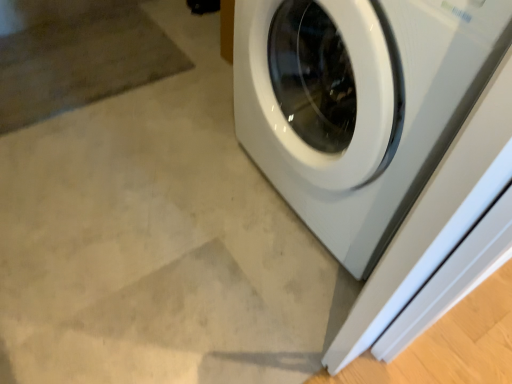
What do you see at coordinates (359, 104) in the screenshot? I see `white glossy washing machine at lower right` at bounding box center [359, 104].

Measure the distance between white glossy washing machine at lower right and camera.

They are 20.46 inches apart.

Locate an element on the screen. The width and height of the screenshot is (512, 384). white glossy washing machine at lower right is located at coordinates (359, 104).

Find the location of a particular element. Image resolution: width=512 pixels, height=384 pixels. white glossy washing machine at lower right is located at coordinates (359, 104).